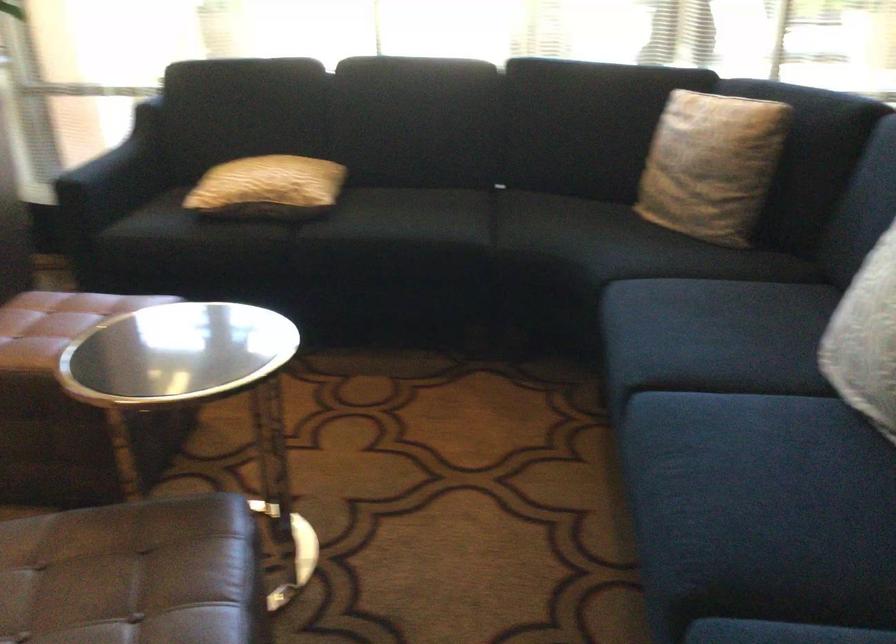
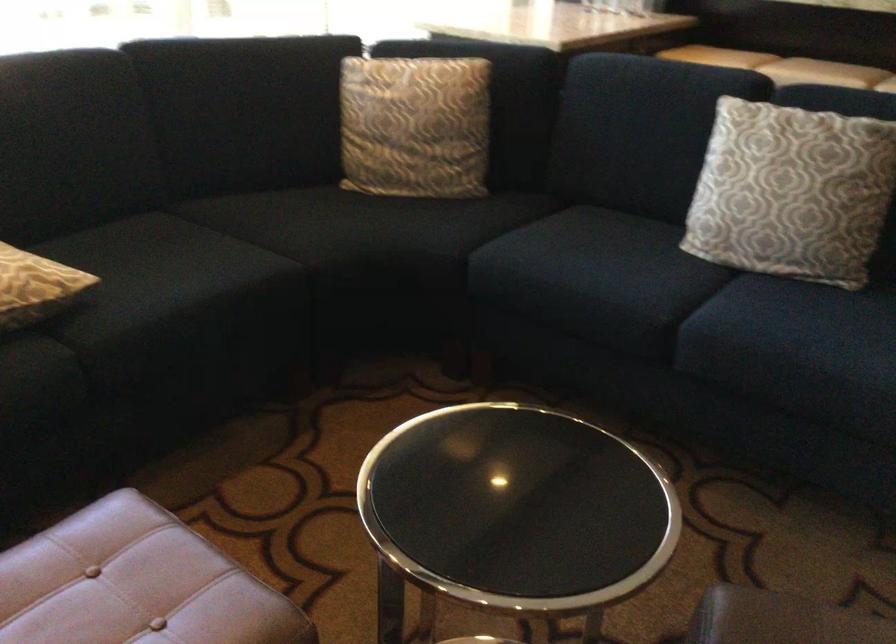
Locate, in the second image, the point that corresponds to [569,231] in the first image.

(348, 227)